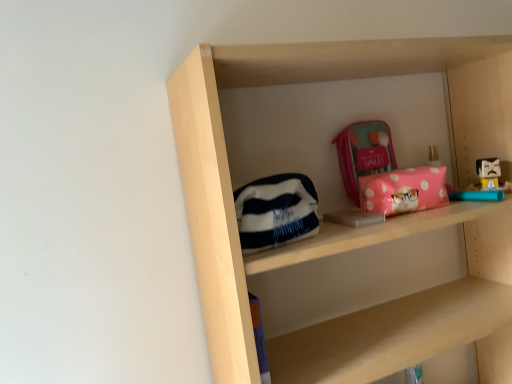
Question: Is white fleece pouch at center, marked as the 2th pouch in a back-to-front arrangement, to the left of pink polka dot pouch at center from the viewer's perspective?

Choices:
 (A) no
 (B) yes

Answer: (B)

Question: Considering the relative sizes of white fleece pouch at center, acting as the first pouch starting from the front, and pink polka dot pouch at center in the image provided, is white fleece pouch at center, acting as the first pouch starting from the front, wider than pink polka dot pouch at center?

Choices:
 (A) no
 (B) yes

Answer: (A)

Question: From the image's perspective, is white fleece pouch at center, marked as the 2th pouch in a back-to-front arrangement, on top of pink polka dot pouch at center?

Choices:
 (A) no
 (B) yes

Answer: (A)

Question: From a real-world perspective, is white fleece pouch at center, which appears as the 2th pouch when viewed from the right, located higher than pink polka dot pouch at center?

Choices:
 (A) yes
 (B) no

Answer: (A)

Question: From the image's perspective, is white fleece pouch at center, acting as the first pouch starting from the front, under pink polka dot pouch at center?

Choices:
 (A) yes
 (B) no

Answer: (A)

Question: In terms of height, does pink polka dot pouch at center look taller or shorter compared to white fleece pouch at center, acting as the first pouch starting from the front?

Choices:
 (A) short
 (B) tall

Answer: (A)

Question: Would you say pink polka dot pouch at center is to the left or to the right of white fleece pouch at center, acting as the first pouch starting from the front, in the picture?

Choices:
 (A) right
 (B) left

Answer: (A)

Question: From a real-world perspective, is pink polka dot pouch at center physically located above or below white fleece pouch at center, the first pouch in the bottom-to-top sequence?

Choices:
 (A) below
 (B) above

Answer: (A)

Question: Considering the positions of point (360, 206) and point (241, 193), is point (360, 206) closer or farther from the camera than point (241, 193)?

Choices:
 (A) closer
 (B) farther

Answer: (B)

Question: From a real-world perspective, is white fleece pouch at center, the first pouch in the bottom-to-top sequence, positioned above or below matte pink pouch at upper center, the 2th pouch positioned from the bottom?

Choices:
 (A) above
 (B) below

Answer: (B)

Question: In terms of size, does white fleece pouch at center, marked as the 2th pouch in a back-to-front arrangement, appear bigger or smaller than matte pink pouch at upper center, which is the first pouch from top to bottom?

Choices:
 (A) small
 (B) big

Answer: (B)

Question: From their relative heights in the image, would you say white fleece pouch at center, which appears as the 2th pouch when viewed from the right, is taller or shorter than matte pink pouch at upper center, the 1th pouch positioned from the back?

Choices:
 (A) tall
 (B) short

Answer: (A)

Question: Based on their positions, is white fleece pouch at center, which appears as the first pouch when viewed from the left, located to the left or right of matte pink pouch at upper center, arranged as the first pouch when viewed from the right?

Choices:
 (A) right
 (B) left

Answer: (B)

Question: Does point (348, 144) appear closer or farther from the camera than point (306, 211)?

Choices:
 (A) closer
 (B) farther

Answer: (B)

Question: From a real-world perspective, relative to white fleece pouch at center, acting as the first pouch starting from the front, is matte pink pouch at upper center, the 2th pouch positioned from the bottom, vertically above or below?

Choices:
 (A) below
 (B) above

Answer: (B)